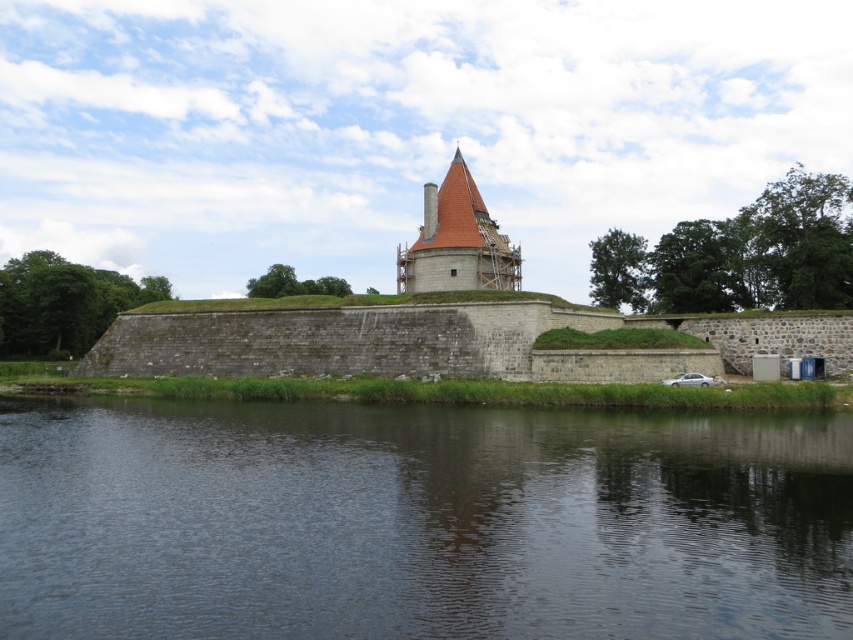
Question: Is dark water at lower center further to camera compared to brown tiled tower at center?

Choices:
 (A) yes
 (B) no

Answer: (B)

Question: Can you confirm if dark water at lower center is bigger than brown tiled tower at center?

Choices:
 (A) yes
 (B) no

Answer: (A)

Question: Which point is closer to the camera?

Choices:
 (A) dark water at lower center
 (B) brown tiled tower at center

Answer: (A)

Question: Among these objects, which one is farthest from the camera?

Choices:
 (A) dark water at lower center
 (B) brown tiled tower at center

Answer: (B)

Question: Does dark water at lower center have a smaller size compared to brown tiled tower at center?

Choices:
 (A) no
 (B) yes

Answer: (A)

Question: Among these objects, which one is nearest to the camera?

Choices:
 (A) brown tiled tower at center
 (B) dark water at lower center

Answer: (B)